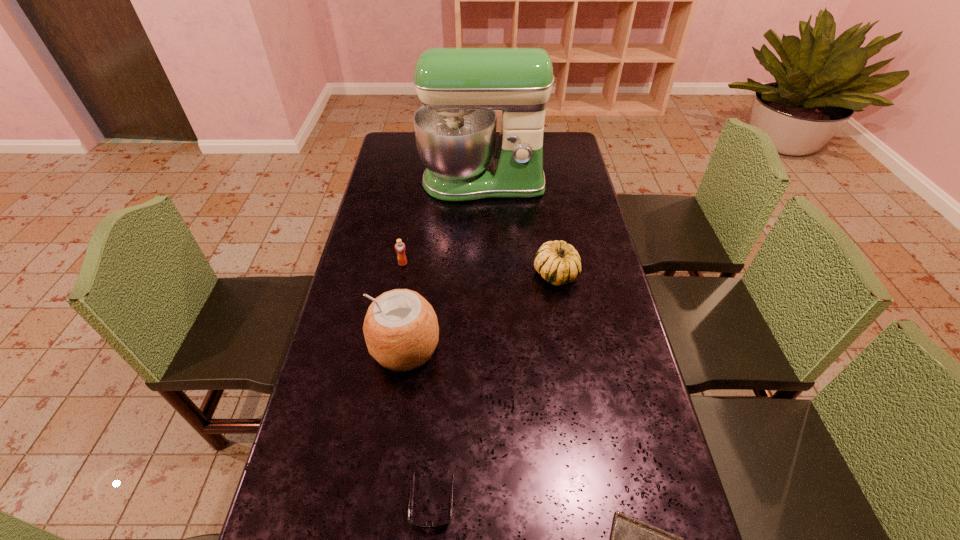
Where is `the tallest object`? This screenshot has height=540, width=960. the tallest object is located at coordinates (460, 88).

Locate an element on the screen. the farthest object is located at coordinates (460, 88).

Find the location of `the fourth farthest object`. the fourth farthest object is located at coordinates (401, 331).

I want to click on the second tallest object, so click(x=401, y=331).

The height and width of the screenshot is (540, 960). Find the location of `gourd`. gourd is located at coordinates (559, 263).

At what (x,y) coordinates should I click in order to perform the action: click on orange juice. Please return your answer as a coordinate pair (x, y). Looking at the image, I should click on (400, 248).

Image resolution: width=960 pixels, height=540 pixels. I want to click on sunglasses, so click(444, 525).

Where is `vacant space located on the controls of the mixer`? This screenshot has width=960, height=540. vacant space located on the controls of the mixer is located at coordinates (483, 231).

Where is `vacant space located on the right of the third nearest object`? Image resolution: width=960 pixels, height=540 pixels. vacant space located on the right of the third nearest object is located at coordinates (515, 348).

Image resolution: width=960 pixels, height=540 pixels. Find the location of `vacant region located on the front of the gourd`. vacant region located on the front of the gourd is located at coordinates (568, 349).